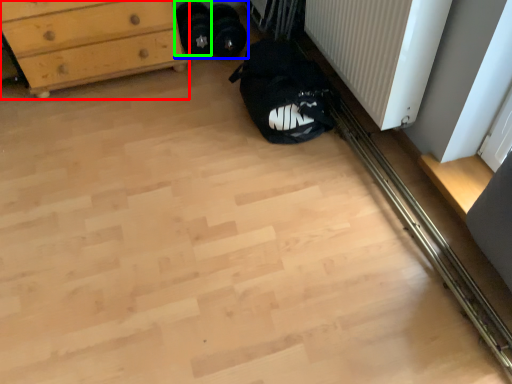
Question: Estimate the real-world distances between objects in this image. Which object is farther from chest of drawers (highlighted by a red box), footwear (highlighted by a blue box) or footwear (highlighted by a green box)?

Choices:
 (A) footwear
 (B) footwear

Answer: (B)